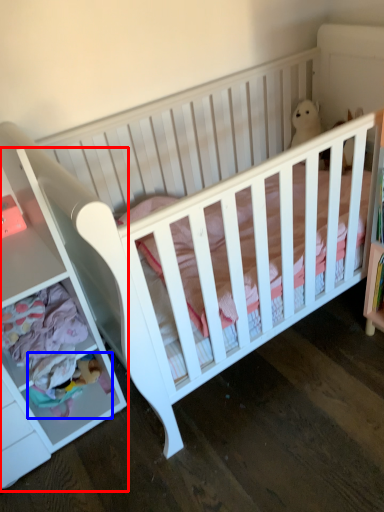
Question: Which point is further to the camera, dresser (highlighted by a red box) or toy (highlighted by a blue box)?

Choices:
 (A) dresser
 (B) toy

Answer: (B)